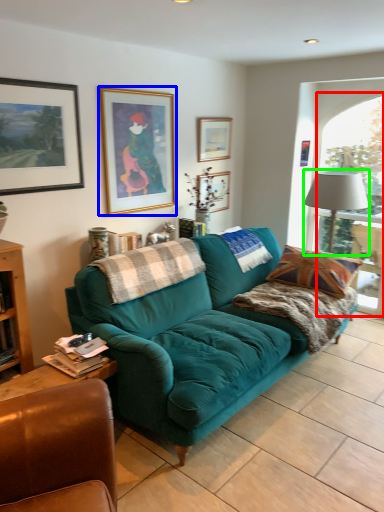
Question: Estimate the real-world distances between objects in this image. Which object is farther from window (highlighted by a red box), picture frame (highlighted by a blue box) or lamp (highlighted by a green box)?

Choices:
 (A) picture frame
 (B) lamp

Answer: (A)